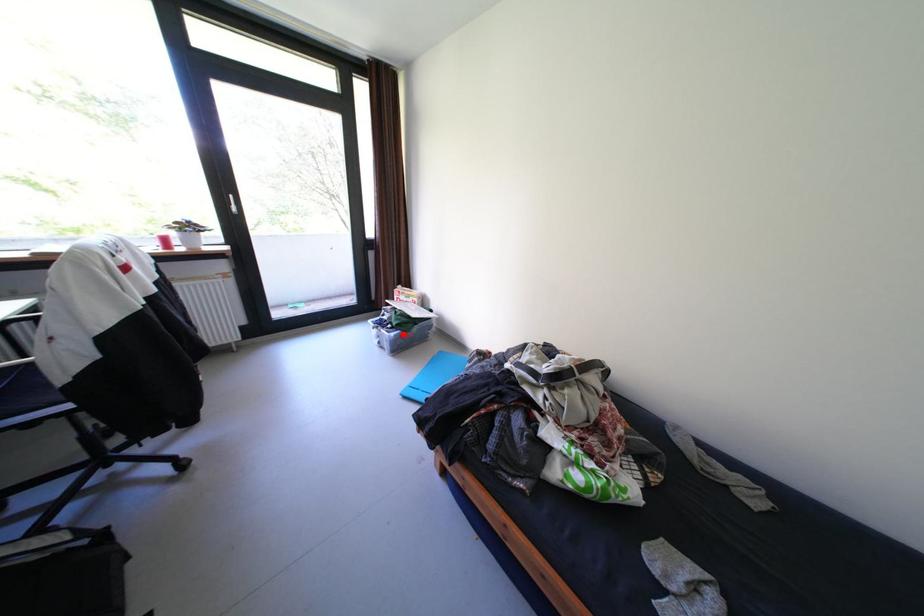
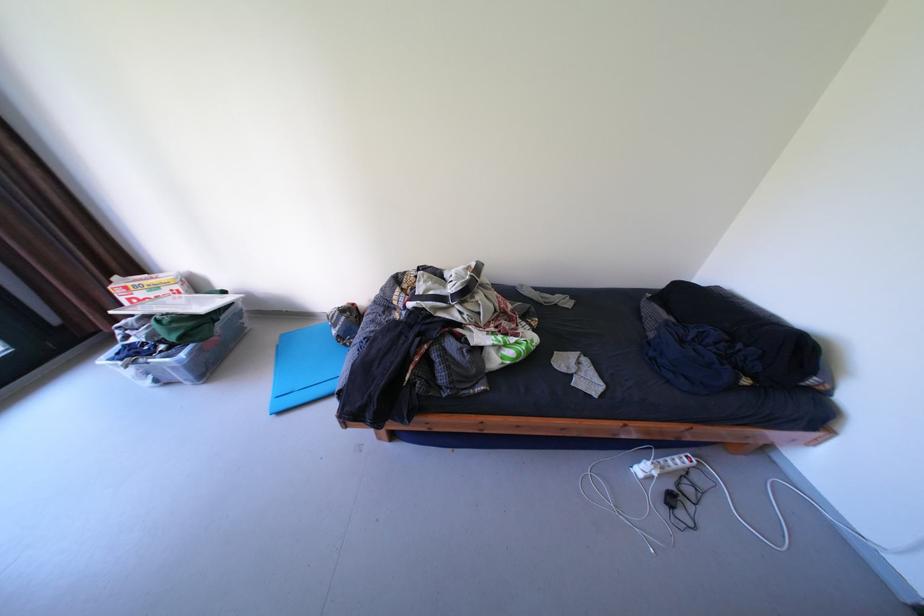
Question: I am providing you with two images of the same scene from different viewpoints. Given a red point in image1, look at the same physical point in image2. Is it:

Choices:
 (A) Closer to the viewpoint
 (B) Farther from the viewpoint

Answer: (A)